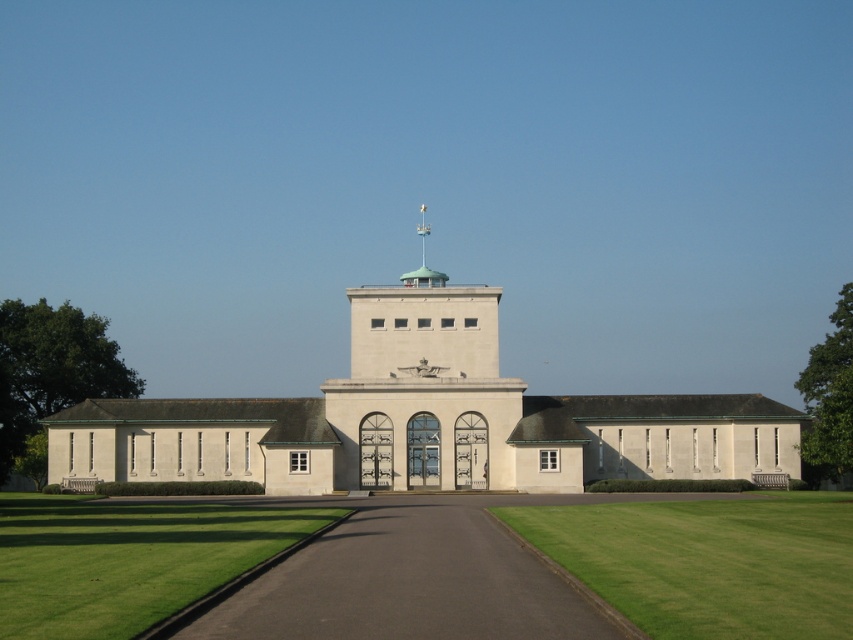
Question: Which object is positioned farthest from the green grass at center?

Choices:
 (A) black asphalt driveway at center
 (B) white stone bell tower at center

Answer: (B)

Question: Is green grass at center to the right of white stone bell tower at center from the viewer's perspective?

Choices:
 (A) yes
 (B) no

Answer: (A)

Question: Which object is the farthest from the green grass at lower left?

Choices:
 (A) black asphalt driveway at center
 (B) green grass at center

Answer: (B)

Question: Which point is farther to the camera?

Choices:
 (A) green grass at lower left
 (B) green grass at center

Answer: (A)

Question: Is black asphalt driveway at center closer to camera compared to green grass at center?

Choices:
 (A) yes
 (B) no

Answer: (B)

Question: Considering the relative positions of black asphalt driveway at center and green grass at center in the image provided, where is black asphalt driveway at center located with respect to green grass at center?

Choices:
 (A) below
 (B) above

Answer: (B)